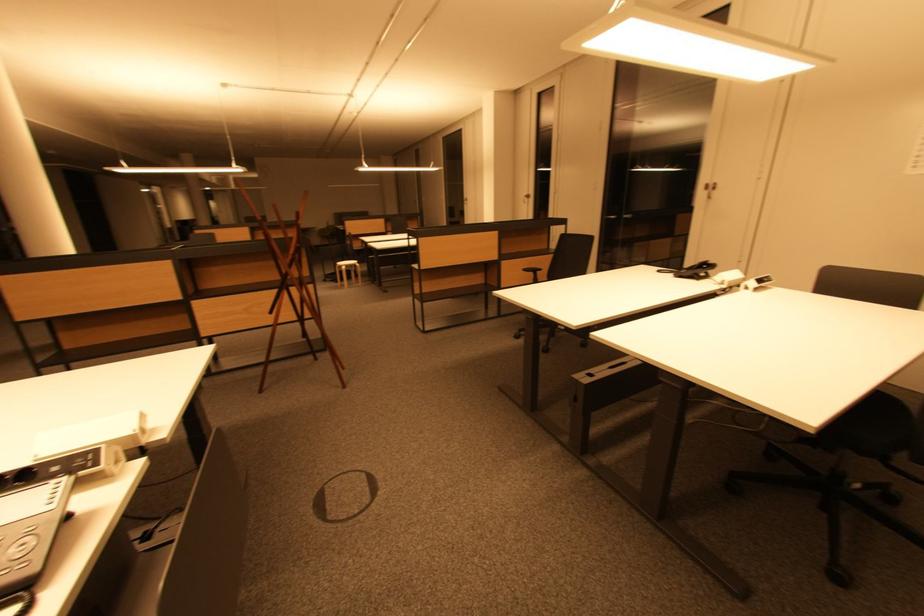
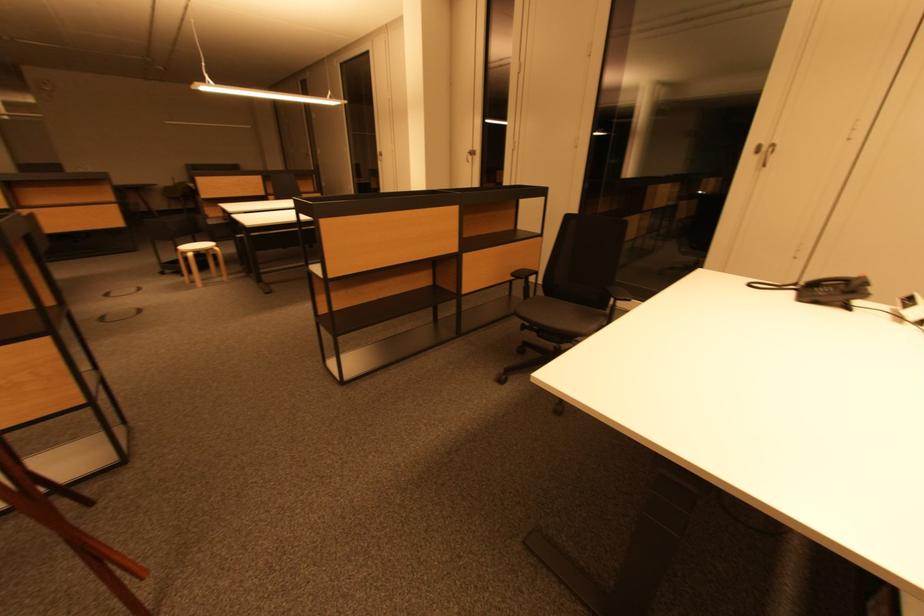
Where in the second image is the point corresponding to point (713, 188) from the first image?

(767, 150)